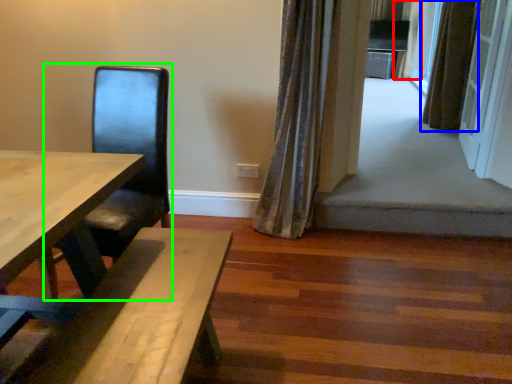
Question: Which object is positioned farthest from curtain (highlighted by a red box)? Select from curtain (highlighted by a blue box) and armchair (highlighted by a green box).

Choices:
 (A) curtain
 (B) armchair

Answer: (B)